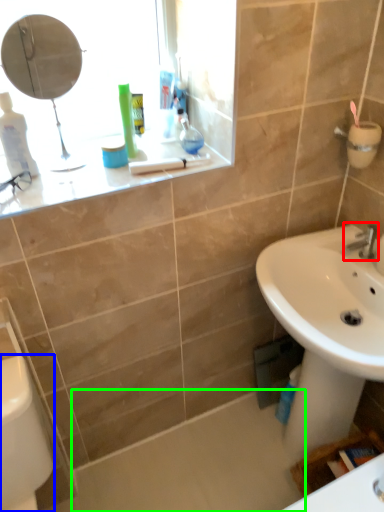
Question: Which is nearer to the tap (highlighted by a red box)? porcelain (highlighted by a blue box) or bath (highlighted by a green box).

Choices:
 (A) porcelain
 (B) bath

Answer: (B)